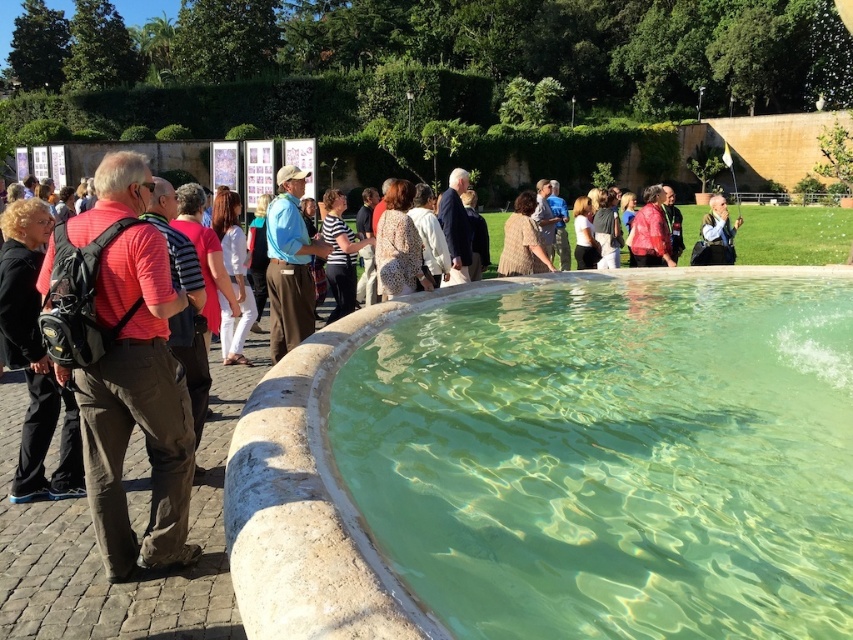
Question: Which point appears closest to the camera in this image?

Choices:
 (A) (144, 189)
 (B) (291, 248)
 (C) (718, 236)

Answer: (A)

Question: Does clear stone pool at center have a smaller size compared to matte black backpack at left?

Choices:
 (A) yes
 (B) no

Answer: (A)

Question: Observing the image, what is the correct spatial positioning of clear stone pool at center in reference to matte black backpack at left?

Choices:
 (A) above
 (B) below

Answer: (B)

Question: Which of the following is the farthest from the observer?

Choices:
 (A) white fabric bag at upper right
 (B) light blue cotton shirt at center
 (C) matte black backpack at left
 (D) clear stone pool at center

Answer: (A)

Question: Which point is closer to the camera?

Choices:
 (A) (390, 321)
 (B) (149, 410)
 (C) (300, 288)

Answer: (B)

Question: Can you confirm if clear stone pool at center is positioned below matte black backpack at left?

Choices:
 (A) no
 (B) yes

Answer: (B)